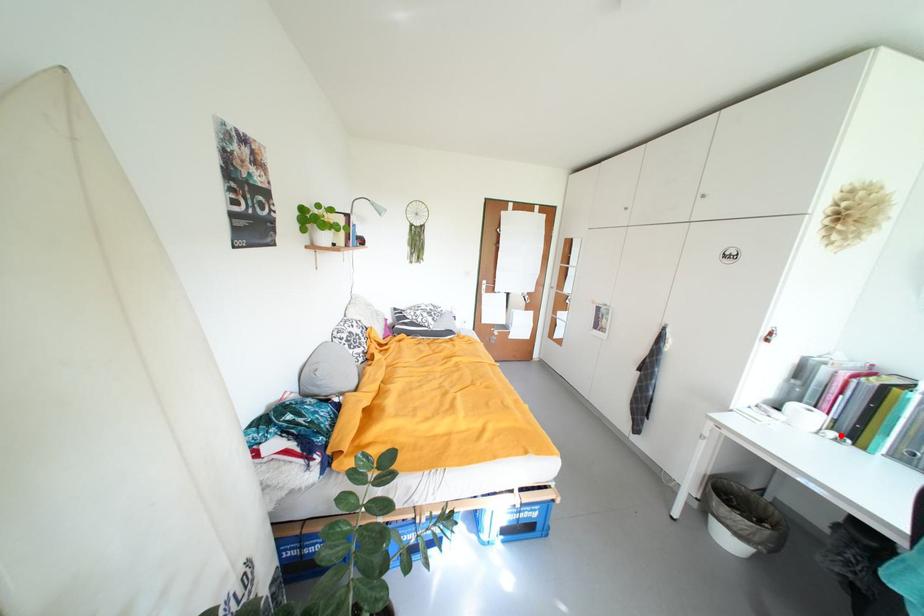
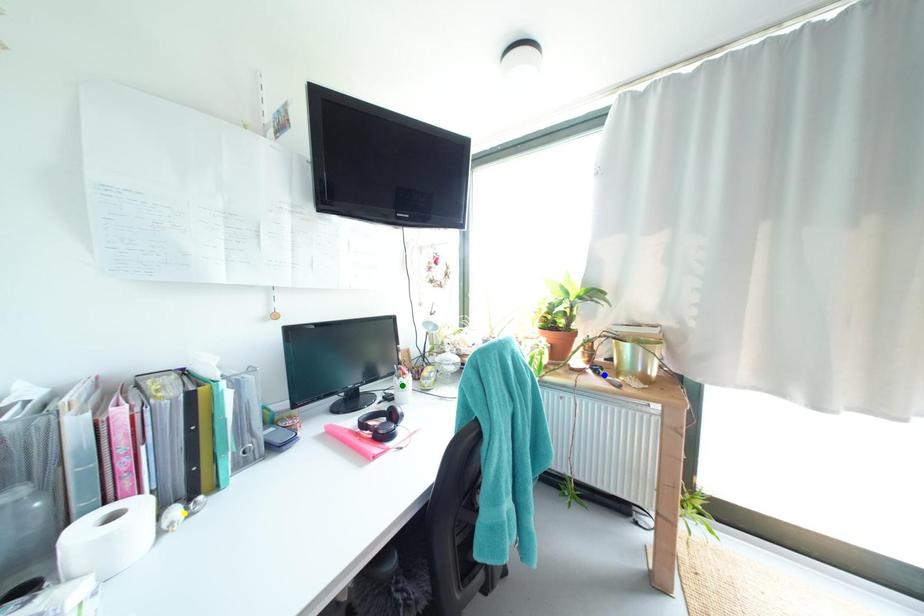
Question: I am providing you with two images of the same scene from different viewpoints. A red point is marked on the first image. You are given multiple points on the second image. Which spot in image 2 lines up with the point in image 1?

Choices:
 (A) blue point
 (B) green point
 (C) yellow point

Answer: (C)